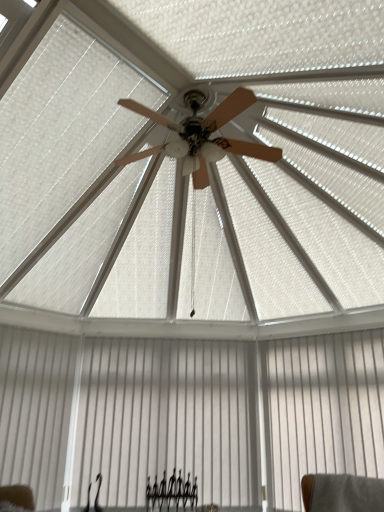
Question: Does white smooth shutter at lower left have a larger size compared to white matte curtain at lower center, which is counted as the 1th curtain, starting from the left?

Choices:
 (A) yes
 (B) no

Answer: (B)

Question: Is white smooth shutter at lower left to the left of white matte curtain at lower center, which is counted as the 1th curtain, starting from the left, from the viewer's perspective?

Choices:
 (A) yes
 (B) no

Answer: (A)

Question: Is white smooth shutter at lower left positioned with its back to white matte curtain at lower center, the 2th curtain from the right?

Choices:
 (A) yes
 (B) no

Answer: (B)

Question: Are white smooth shutter at lower left and white matte curtain at lower center, the 2th curtain from the right, beside each other?

Choices:
 (A) no
 (B) yes

Answer: (A)

Question: Does white smooth shutter at lower left have a lesser height compared to white matte curtain at lower center, the 2th curtain from the right?

Choices:
 (A) yes
 (B) no

Answer: (A)

Question: From a real-world perspective, is white matte curtain at lower center, the 2th curtain from the right, above or below white textured curtain at lower right, which ranks as the second curtain in left-to-right order?

Choices:
 (A) above
 (B) below

Answer: (B)

Question: From the image's perspective, is white matte curtain at lower center, the 2th curtain from the right, positioned above or below white textured curtain at lower right, which appears as the 1th curtain when viewed from the right?

Choices:
 (A) below
 (B) above

Answer: (A)

Question: Based on their positions, is white matte curtain at lower center, which is counted as the 1th curtain, starting from the left, located to the left or right of white textured curtain at lower right, which ranks as the second curtain in left-to-right order?

Choices:
 (A) left
 (B) right

Answer: (A)

Question: Looking at the image, does white matte curtain at lower center, the 2th curtain from the right, seem bigger or smaller compared to white textured curtain at lower right, which appears as the 1th curtain when viewed from the right?

Choices:
 (A) big
 (B) small

Answer: (B)

Question: Considering the positions of white matte curtain at lower center, which is counted as the 1th curtain, starting from the left, and white smooth shutter at lower left in the image, is white matte curtain at lower center, which is counted as the 1th curtain, starting from the left, wider or thinner than white smooth shutter at lower left?

Choices:
 (A) thin
 (B) wide

Answer: (A)

Question: Is point (130, 416) positioned closer to the camera than point (31, 340)?

Choices:
 (A) closer
 (B) farther

Answer: (B)

Question: Visually, is white matte curtain at lower center, which is counted as the 1th curtain, starting from the left, positioned to the left or to the right of white smooth shutter at lower left?

Choices:
 (A) right
 (B) left

Answer: (A)

Question: Relative to white smooth shutter at lower left, is white matte curtain at lower center, which is counted as the 1th curtain, starting from the left, in front or behind?

Choices:
 (A) front
 (B) behind

Answer: (B)

Question: Considering the positions of point click(152, 505) and point click(72, 369), is point click(152, 505) closer or farther from the camera than point click(72, 369)?

Choices:
 (A) farther
 (B) closer

Answer: (B)

Question: Considering the positions of black metal fence at lower center and white smooth shutter at lower left in the image, is black metal fence at lower center wider or thinner than white smooth shutter at lower left?

Choices:
 (A) thin
 (B) wide

Answer: (B)